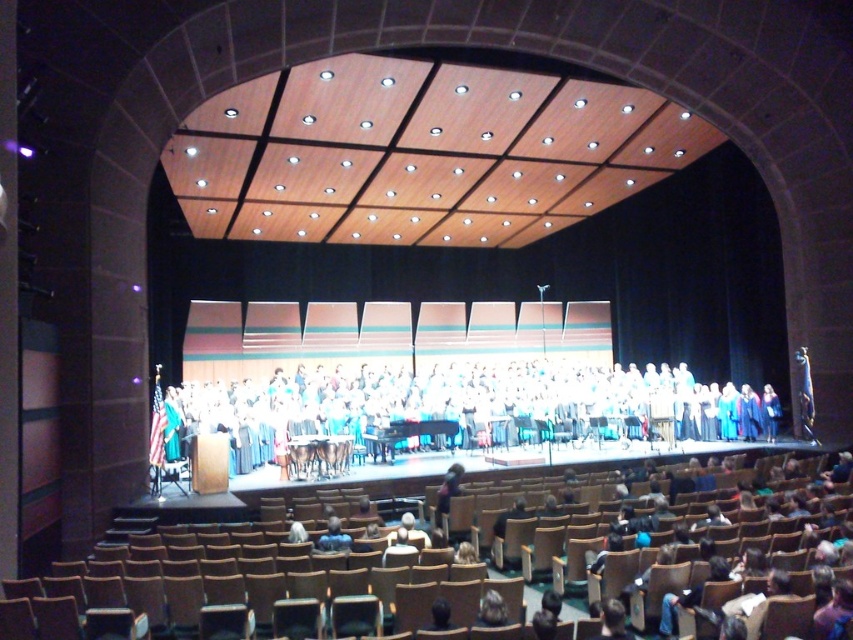
You are an event organizer who needs to arrange two leather jackets on the stage. The dark brown leather jacket at center and the light brown leather jacket at lower center must be placed such that the wider jacket is on the left side of the stage. Which jacket should be placed on the left?

The dark brown leather jacket at center should be placed on the left side of the stage since it is wider than the light brown leather jacket at lower center.

In the scene shown: You are an event organizer who needs to adjust the stage setup. You notice the white fabric choir at center and the light brown wooden chair at center. Which object is placed above the other?

The white fabric choir at center is positioned over the light brown wooden chair at center, meaning the choir is above the chair.

Imagine you are sitting in the front row of the auditorium and looking towards the stage. You notice a light brown wooden chair at center and a black hair at center. Which object is bigger in size?

The light brown wooden chair at center is larger in size compared to the black hair at center.